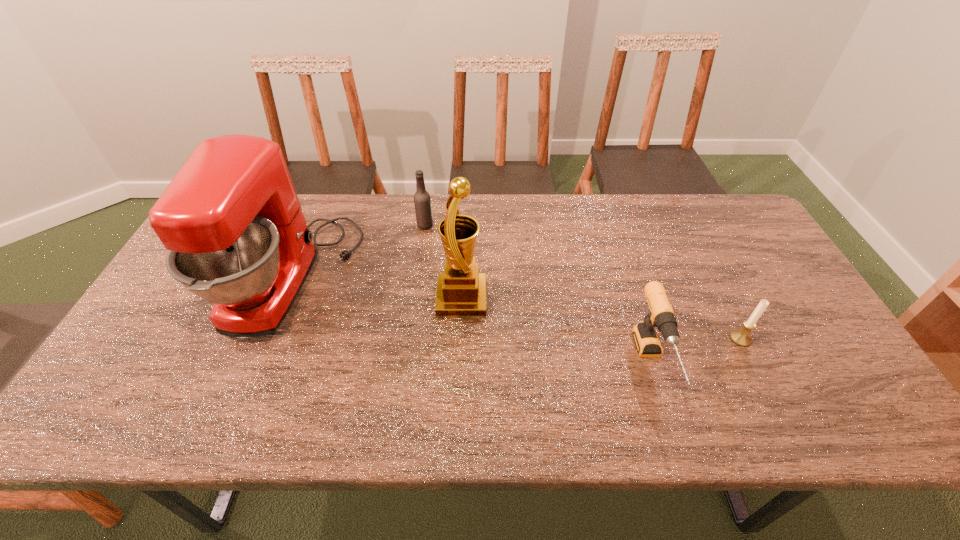
Where is `object that is the nearest to the beer bottle`? The height and width of the screenshot is (540, 960). object that is the nearest to the beer bottle is located at coordinates (237, 237).

Find the location of a particular element. This screenshot has width=960, height=540. object that is the third closest to the fourth object from left to right is located at coordinates (422, 201).

At what (x,y) coordinates should I click in order to perform the action: click on vacant space that satisfies the following two spatial constraints: 1. on the label of the third tallest object; 2. on the right side of the candle holder. Please return your answer as a coordinate pair (x, y). Looking at the image, I should click on pyautogui.click(x=410, y=339).

Where is `blank space that satisfies the following two spatial constraints: 1. on the front-facing side of the rightmost object; 2. on the left side of the leftmost object`? Image resolution: width=960 pixels, height=540 pixels. blank space that satisfies the following two spatial constraints: 1. on the front-facing side of the rightmost object; 2. on the left side of the leftmost object is located at coordinates (269, 339).

Locate an element on the screen. This screenshot has height=540, width=960. vacant space that satisfies the following two spatial constraints: 1. on the front-facing side of the candle holder; 2. on the right side of the leftmost object is located at coordinates (269, 339).

The image size is (960, 540). I want to click on vacant space that satisfies the following two spatial constraints: 1. on the front-facing side of the rightmost object; 2. on the right side of the leftmost object, so click(269, 339).